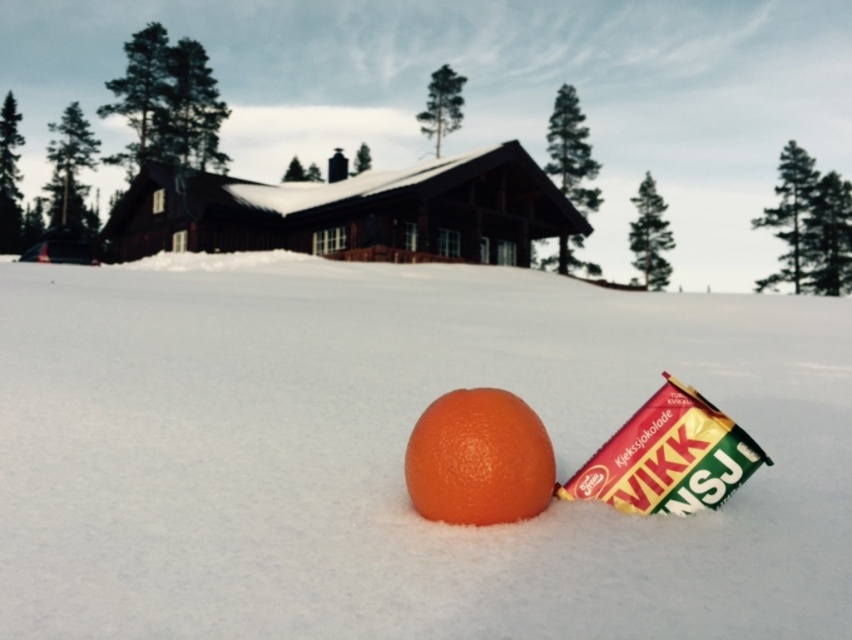
You are an artist trying to paint the winter scene. You want to ensure the orange matte at center is partially hidden by the white fluffy snow at center. Is this possible based on their current positions?

Yes, since the white fluffy snow at center is taller than the orange matte at center, it can partially hide it when painted accordingly.

You are standing at the origin point in the winter scene. There are two points marked in the image. Which point is closer to you? The points are labeled as point (326, 301) and point (442, 397).

Point (442, 397) is closer to you because it is in front of point (326, 301).

You are an observer standing in the winter scene. You see the white fluffy snow at center and the orange matte at center. Which object is closer to you?

The white fluffy snow at center is closer to you since it is in front of the orange matte at center.